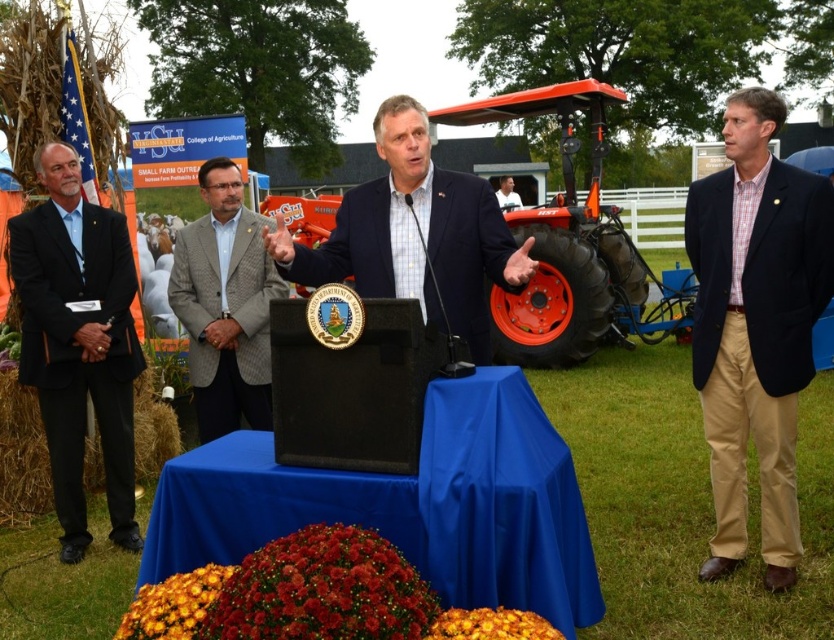
Is dark blue suit at left behind matte blue suit at center?

Yes, dark blue suit at left is behind matte blue suit at center.

Between point (124, 305) and point (342, 253), which one is positioned behind?

Point (124, 305)

Who is more forward, (79, 408) or (476, 291)?

Point (476, 291) is more forward.

Find the location of a particular element. This screenshot has height=640, width=834. dark blue suit at left is located at coordinates (78, 342).

Find the location of a particular element. This screenshot has width=834, height=640. gray wool blazer at center is located at coordinates (225, 305).

Is gray wool blazer at center taller than white shirt at center?

Incorrect, gray wool blazer at center's height is not larger of white shirt at center's.

Between point (198, 227) and point (501, 208), which one is positioned in front?

Point (198, 227) is more forward.

Image resolution: width=834 pixels, height=640 pixels. In order to click on gray wool blazer at center in this screenshot , I will do `click(225, 305)`.

Is plaid shirt at center above gray wool blazer at center?

No, plaid shirt at center is not above gray wool blazer at center.

Is plaid shirt at center smaller than gray wool blazer at center?

No, plaid shirt at center is not smaller than gray wool blazer at center.

What are the coordinates of `plaid shirt at center` in the screenshot? It's located at (755, 324).